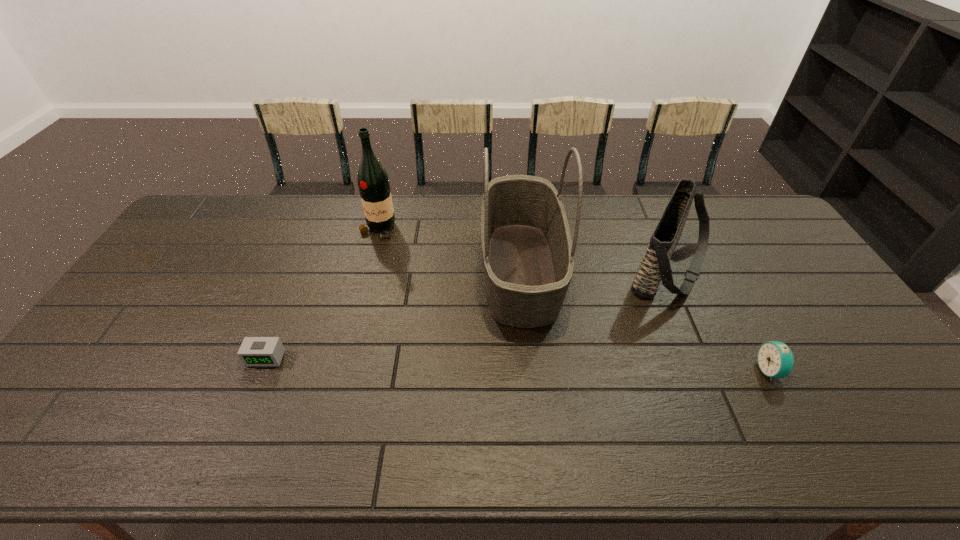
You are a GUI agent. You are given a task and a screenshot of the screen. Output one action in this format:
    pyautogui.click(x=<x>, y=<y>)
    Task: Click on the vacant space at the left edge
    
    Given the screenshot: What is the action you would take?
    pyautogui.click(x=160, y=281)

Identify the location of vacant space at the right edge. The image size is (960, 540). (838, 307).

This screenshot has height=540, width=960. Find the location of `vacant area at the far left corner of the desktop`. vacant area at the far left corner of the desktop is located at coordinates (212, 197).

Identify the location of vacant space at the far right corner of the desktop. (735, 211).

Image resolution: width=960 pixels, height=540 pixels. I want to click on free space between the basket and the second tallest object, so click(x=449, y=249).

Image resolution: width=960 pixels, height=540 pixels. Identify the location of free space between the fourth shortest object and the basket. (449, 249).

Find the location of a particular element. unoccupied area between the handbag and the taller alarm clock is located at coordinates (720, 319).

Identify the location of blank region between the basket and the handbag. This screenshot has width=960, height=540. (595, 268).

The image size is (960, 540). I want to click on vacant space that is in between the basket and the second shortest object, so click(645, 320).

You are a GUI agent. You are given a task and a screenshot of the screen. Output one action in this format:
    pyautogui.click(x=<x>, y=<y>)
    Task: Click on the empty space that is in between the third object from left to right and the shortest object
    
    Given the screenshot: What is the action you would take?
    pyautogui.click(x=394, y=314)